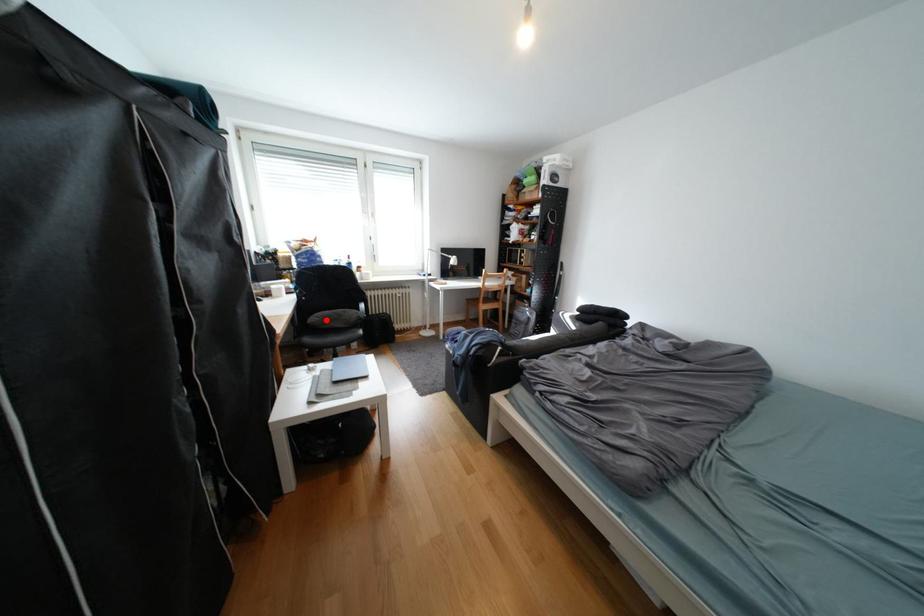
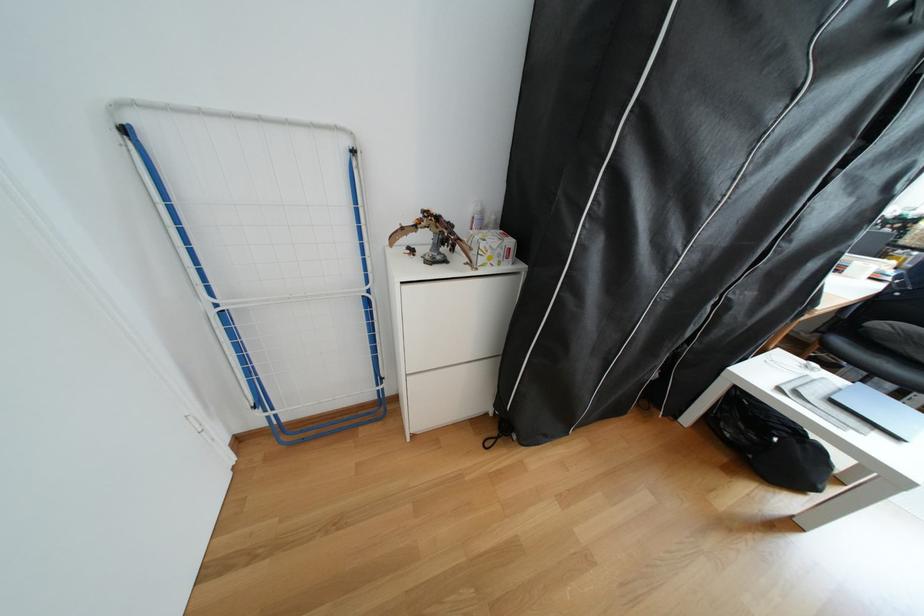
In the second image, find the point that corresponds to the highlighted location in the first image.

(894, 326)